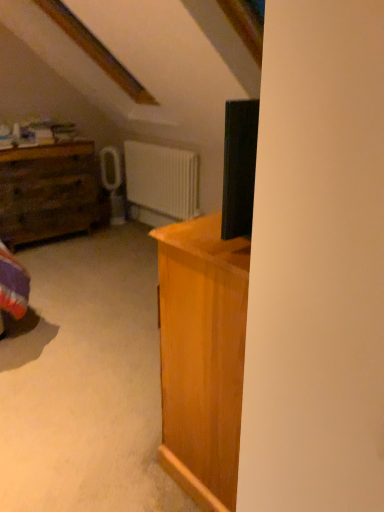
This screenshot has width=384, height=512. What do you see at coordinates (50, 193) in the screenshot?
I see `rustic wood chest of drawers at left` at bounding box center [50, 193].

Where is `rustic wood chest of drawers at left`? This screenshot has width=384, height=512. rustic wood chest of drawers at left is located at coordinates (50, 193).

Locate an element on the screen. white matte radiator at center is located at coordinates (162, 179).

Image resolution: width=384 pixels, height=512 pixels. What do you see at coordinates (162, 179) in the screenshot? I see `white matte radiator at center` at bounding box center [162, 179].

Where is `rustic wood chest of drawers at left`? This screenshot has width=384, height=512. rustic wood chest of drawers at left is located at coordinates (50, 193).

Between rustic wood chest of drawers at left and white matte radiator at center, which one appears on the right side from the viewer's perspective?

white matte radiator at center.

Which object is more forward, rustic wood chest of drawers at left or white matte radiator at center?

rustic wood chest of drawers at left is more forward.

Based on the photo, which is closer to the camera, (15, 223) or (152, 161)?

Point (15, 223) appears to be closer to the viewer than point (152, 161).

From the image's perspective, is rustic wood chest of drawers at left located beneath white matte radiator at center?

Yes.

From a real-world perspective, is rustic wood chest of drawers at left positioned above or below white matte radiator at center?

rustic wood chest of drawers at left is situated lower than white matte radiator at center in the real world.

Considering the sizes of objects rustic wood chest of drawers at left and white matte radiator at center in the image provided, who is thinner, rustic wood chest of drawers at left or white matte radiator at center?

With smaller width is white matte radiator at center.

Considering the relative sizes of rustic wood chest of drawers at left and white matte radiator at center in the image provided, is rustic wood chest of drawers at left taller than white matte radiator at center?

Yes.

Which of these two, rustic wood chest of drawers at left or white matte radiator at center, is bigger?

rustic wood chest of drawers at left.

Is white matte radiator at center inside rustic wood chest of drawers at left?

Actually, white matte radiator at center is outside rustic wood chest of drawers at left.

Are rustic wood chest of drawers at left and white matte radiator at center far apart?

That's not correct — rustic wood chest of drawers at left is a little close to white matte radiator at center.

Is rustic wood chest of drawers at left positioned with its back to white matte radiator at center?

No, white matte radiator at center is not at the back of rustic wood chest of drawers at left.

Measure the distance from rustic wood chest of drawers at left to white matte radiator at center.

rustic wood chest of drawers at left and white matte radiator at center are 31.32 inches apart.

Identify the location of radiator behind the rustic wood chest of drawers at left. (162, 179).

Between white matte radiator at center and rustic wood chest of drawers at left, which one appears on the left side from the viewer's perspective?

rustic wood chest of drawers at left is more to the left.

Between white matte radiator at center and rustic wood chest of drawers at left, which one is positioned behind?

white matte radiator at center is behind.

Is point (168, 164) positioned after point (58, 170)?

Yes, point (168, 164) is behind point (58, 170).

From the image's perspective, is white matte radiator at center located above or below rustic wood chest of drawers at left?

From the image's perspective, white matte radiator at center appears above rustic wood chest of drawers at left.

From a real-world perspective, is white matte radiator at center physically located above or below rustic wood chest of drawers at left?

Clearly, from a real-world perspective, white matte radiator at center is above rustic wood chest of drawers at left.

Which of these two, white matte radiator at center or rustic wood chest of drawers at left, is thinner?

white matte radiator at center.

Considering the relative sizes of white matte radiator at center and rustic wood chest of drawers at left in the image provided, is white matte radiator at center shorter than rustic wood chest of drawers at left?

Yes.

In terms of size, does white matte radiator at center appear bigger or smaller than rustic wood chest of drawers at left?

Considering their sizes, white matte radiator at center takes up less space than rustic wood chest of drawers at left.

Is rustic wood chest of drawers at left inside white matte radiator at center?

No, white matte radiator at center does not contain rustic wood chest of drawers at left.

Is white matte radiator at center not close to rustic wood chest of drawers at left?

They are positioned close to each other.

Is white matte radiator at center aimed at rustic wood chest of drawers at left?

Yes, white matte radiator at center is aimed at rustic wood chest of drawers at left.

How different are the orientations of white matte radiator at center and rustic wood chest of drawers at left in degrees?

89.2 degrees separate the facing orientations of white matte radiator at center and rustic wood chest of drawers at left.

Locate an element on the screen. radiator on the right of rustic wood chest of drawers at left is located at coordinates (162, 179).

You are a GUI agent. You are given a task and a screenshot of the screen. Output one action in this format:
    pyautogui.click(x=<x>, y=<y>)
    Task: Click on the chest of drawers below the white matte radiator at center (from a real-world perspective)
    This screenshot has width=384, height=512.
    Given the screenshot: What is the action you would take?
    pyautogui.click(x=50, y=193)

This screenshot has height=512, width=384. There is a rustic wood chest of drawers at left. In order to click on radiator above it (from a real-world perspective) in this screenshot , I will do `click(162, 179)`.